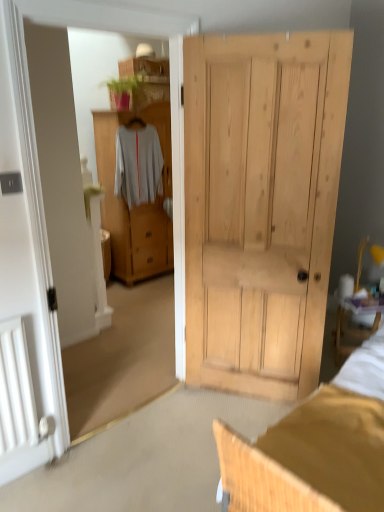
Question: Are light brown wood cabinet at center and white matte sweater at center located far from each other?

Choices:
 (A) yes
 (B) no

Answer: (B)

Question: Considering the relative sizes of light brown wood cabinet at center and white matte sweater at center in the image provided, is light brown wood cabinet at center smaller than white matte sweater at center?

Choices:
 (A) no
 (B) yes

Answer: (A)

Question: Is white matte sweater at center located within light brown wood cabinet at center?

Choices:
 (A) yes
 (B) no

Answer: (A)

Question: From the image's perspective, is light brown wood cabinet at center over white matte sweater at center?

Choices:
 (A) no
 (B) yes

Answer: (A)

Question: Is light brown wood cabinet at center shorter than white matte sweater at center?

Choices:
 (A) yes
 (B) no

Answer: (B)

Question: Is light brown wood cabinet at center positioned with its back to white matte sweater at center?

Choices:
 (A) no
 (B) yes

Answer: (B)

Question: Does white matte sweater at center appear on the right side of light brown wood cabinet at center?

Choices:
 (A) yes
 (B) no

Answer: (B)

Question: From a real-world perspective, is white matte sweater at center below light brown wood cabinet at center?

Choices:
 (A) yes
 (B) no

Answer: (B)

Question: Is white matte sweater at center thinner than light brown wood cabinet at center?

Choices:
 (A) yes
 (B) no

Answer: (A)

Question: Is the depth of white matte sweater at center greater than that of light brown wood cabinet at center?

Choices:
 (A) no
 (B) yes

Answer: (A)

Question: Is light brown wood cabinet at center located within white matte sweater at center?

Choices:
 (A) no
 (B) yes

Answer: (A)

Question: Considering the relative sizes of white matte sweater at center and light brown wood cabinet at center in the image provided, is white matte sweater at center wider than light brown wood cabinet at center?

Choices:
 (A) no
 (B) yes

Answer: (A)

Question: From the image's perspective, is white matte sweater at center located above or below light brown wood cabinet at center?

Choices:
 (A) below
 (B) above

Answer: (B)